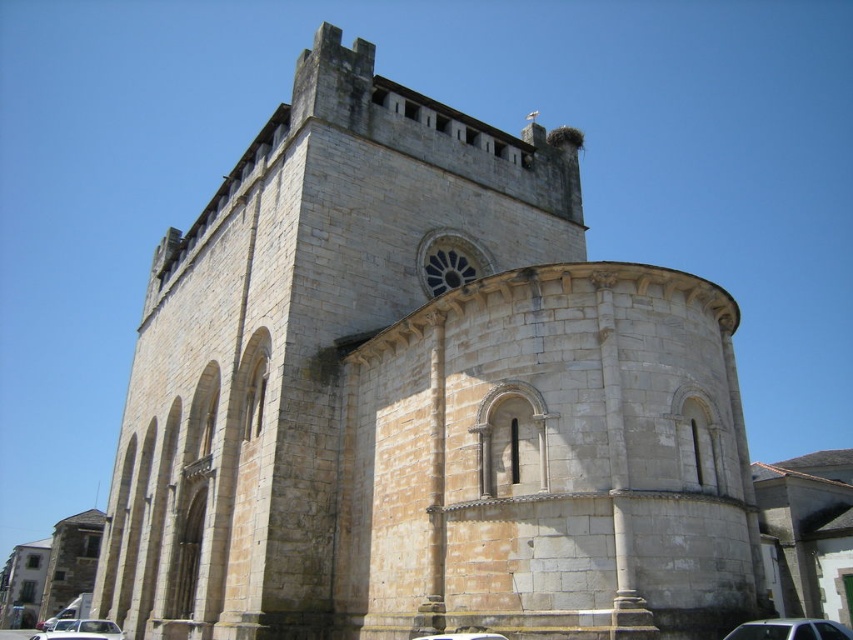
You are a pedestrian standing in front of the historic stone church. You notice two white matte cars parked near the lower part of the image. Which car is closer to you, the white matte car at lower left or the white matte car at lower center?

The white matte car at lower left is closer to you because it is further to the viewer than the white matte car at lower center.

You are standing in front of the historic stone church and notice two points marked on its facade. The first point is at coordinates point [788,625] and the second is at point [114,628]. Which of these two points is positioned closer to your viewpoint?

Point [788,625] is closer to the viewer than point [114,628].

You are standing at the point marked as point (x=82, y=628) in the image. What object is located at this specific coordinate?

The white matte car at lower left is located at point (x=82, y=628).